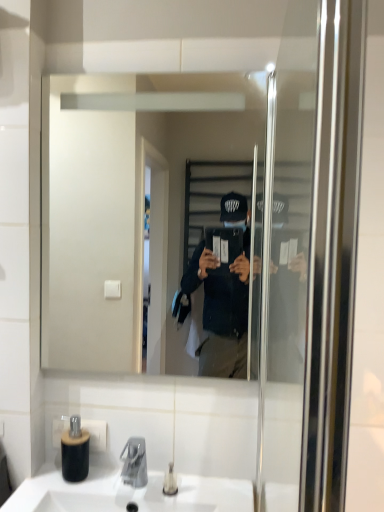
Question: In the image, is black matte bottle at lower left on the left side or the right side of white ceramic sink at lower center?

Choices:
 (A) right
 (B) left

Answer: (B)

Question: From a real-world perspective, relative to white ceramic sink at lower center, is black matte bottle at lower left vertically above or below?

Choices:
 (A) above
 (B) below

Answer: (A)

Question: Estimate the real-world distances between objects in this image. Which object is farther from the black matte bottle at lower left?

Choices:
 (A) clear glass mirror at center
 (B) clear plastic bottle at lower center
 (C) white ceramic sink at lower center

Answer: (A)

Question: Which object is the closest to the white ceramic sink at lower center?

Choices:
 (A) clear glass mirror at center
 (B) clear plastic bottle at lower center
 (C) black matte bottle at lower left

Answer: (C)